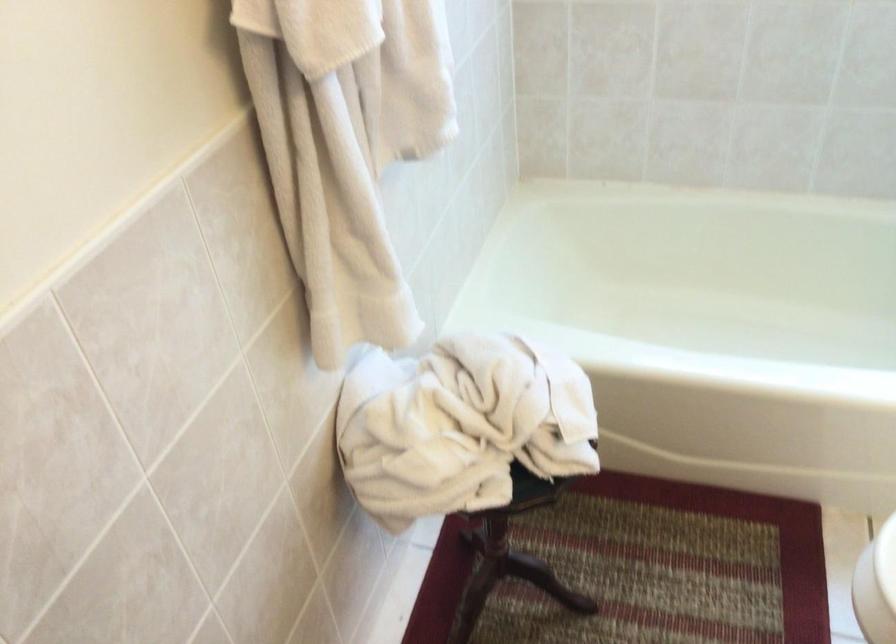
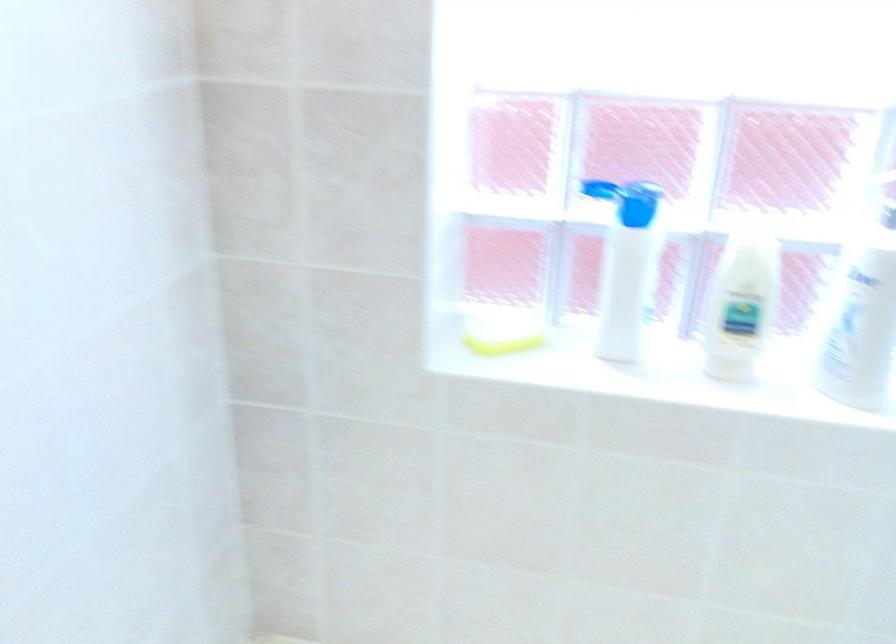
What movement of the cameraman would produce the second image?

The movement direction of the cameraman is right, forward.